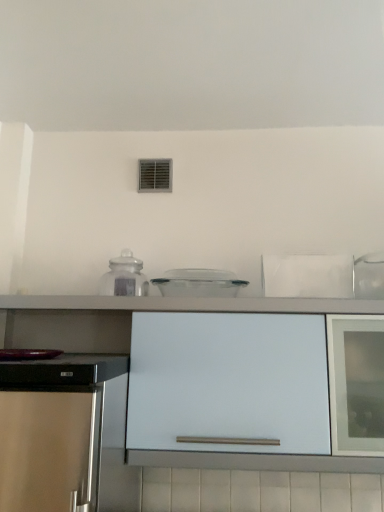
At what (x,y) coordinates should I click in order to perform the action: click on white matte cabinet at center. Please return your answer as a coordinate pair (x, y). Looking at the image, I should click on (201, 387).

In order to click on transparent glass jar at center, the first kitchen appliance positioned from the left in this screenshot , I will do `click(124, 277)`.

The height and width of the screenshot is (512, 384). I want to click on white matte cabinet at center, so click(201, 387).

Which is less distant, (164, 430) or (220, 280)?

Point (164, 430) is positioned closer to the camera compared to point (220, 280).

Identify the location of cabinetry that appears below the transparent plastic container at center, which is counted as the first kitchen appliance, starting from the right (from a real-world perspective). This screenshot has width=384, height=512. (201, 387).

Is white matte cabinet at center to the left of transparent plastic container at center, which is counted as the first kitchen appliance, starting from the right, from the viewer's perspective?

Yes.

Is transparent plastic container at center, which is counted as the first kitchen appliance, starting from the right, turned away from white matte cabinet at center?

No, transparent plastic container at center, which is counted as the first kitchen appliance, starting from the right, is not facing away from white matte cabinet at center.

Does point (167, 281) lie in front of point (115, 360)?

That is False.

Which object is further away from the camera taking this photo, transparent plastic container at center, which is counted as the first kitchen appliance, starting from the right, or white matte cabinet at center?

transparent plastic container at center, which is counted as the first kitchen appliance, starting from the right, is further from the camera.

Who is shorter, transparent plastic container at center, the 2th kitchen appliance viewed from the left, or white matte cabinet at center?

transparent plastic container at center, the 2th kitchen appliance viewed from the left.

Is the position of transparent glass jar at center, the first kitchen appliance positioned from the left, more distant than that of white matte cabinet at center?

Yes, transparent glass jar at center, the first kitchen appliance positioned from the left, is further from the camera.

Locate an element on the screen. Image resolution: width=384 pixels, height=512 pixels. kitchen appliance located on the left of white matte cabinet at center is located at coordinates (124, 277).

From the picture: Is transparent glass jar at center, the 2th kitchen appliance when ordered from right to left, far away from white matte cabinet at center?

transparent glass jar at center, the 2th kitchen appliance when ordered from right to left, is actually quite close to white matte cabinet at center.

From the image's perspective, which is above, transparent glass jar at center, the 2th kitchen appliance when ordered from right to left, or white matte cabinet at center?

transparent glass jar at center, the 2th kitchen appliance when ordered from right to left, is shown above in the image.

Considering the relative sizes of transparent glass jar at center, the first kitchen appliance positioned from the left, and transparent plastic container at center, the 2th kitchen appliance viewed from the left, in the image provided, is transparent glass jar at center, the first kitchen appliance positioned from the left, thinner than transparent plastic container at center, the 2th kitchen appliance viewed from the left,?

Yes.

Is transparent glass jar at center, the 2th kitchen appliance when ordered from right to left, facing towards transparent plastic container at center, the 2th kitchen appliance viewed from the left?

No, transparent glass jar at center, the 2th kitchen appliance when ordered from right to left, is not oriented towards transparent plastic container at center, the 2th kitchen appliance viewed from the left.

Is there a large distance between transparent glass jar at center, the 2th kitchen appliance when ordered from right to left, and transparent plastic container at center, which is counted as the first kitchen appliance, starting from the right?

No, transparent glass jar at center, the 2th kitchen appliance when ordered from right to left, is not far away from transparent plastic container at center, which is counted as the first kitchen appliance, starting from the right.

Which of these two, transparent glass jar at center, the 2th kitchen appliance when ordered from right to left, or transparent plastic container at center, the 2th kitchen appliance viewed from the left, is bigger?

Bigger between the two is transparent plastic container at center, the 2th kitchen appliance viewed from the left.

Is white matte cabinet at center inside or outside of transparent glass jar at center, the first kitchen appliance positioned from the left?

white matte cabinet at center is not inside transparent glass jar at center, the first kitchen appliance positioned from the left, it's outside.

Consider the image. From the image's perspective, is white matte cabinet at center located beneath transparent glass jar at center, the 2th kitchen appliance when ordered from right to left?

Correct, white matte cabinet at center appears lower than transparent glass jar at center, the 2th kitchen appliance when ordered from right to left, in the image.

Considering the sizes of objects white matte cabinet at center and transparent glass jar at center, the first kitchen appliance positioned from the left, in the image provided, who is thinner, white matte cabinet at center or transparent glass jar at center, the first kitchen appliance positioned from the left,?

With smaller width is transparent glass jar at center, the first kitchen appliance positioned from the left.

Does white matte cabinet at center appear on the right side of transparent glass jar at center, the 2th kitchen appliance when ordered from right to left?

Correct, you'll find white matte cabinet at center to the right of transparent glass jar at center, the 2th kitchen appliance when ordered from right to left.

Does transparent plastic container at center, which is counted as the first kitchen appliance, starting from the right, lie in front of transparent glass jar at center, the 2th kitchen appliance when ordered from right to left?

Yes, transparent plastic container at center, which is counted as the first kitchen appliance, starting from the right, is closer to the viewer.

How much distance is there between transparent plastic container at center, the 2th kitchen appliance viewed from the left, and transparent glass jar at center, the 2th kitchen appliance when ordered from right to left?

The distance of transparent plastic container at center, the 2th kitchen appliance viewed from the left, from transparent glass jar at center, the 2th kitchen appliance when ordered from right to left, is 6.74 inches.

This screenshot has height=512, width=384. Find the location of `kitchen appliance that is behind the transparent plastic container at center, which is counted as the first kitchen appliance, starting from the right`. kitchen appliance that is behind the transparent plastic container at center, which is counted as the first kitchen appliance, starting from the right is located at coordinates (124, 277).

Which of these two, transparent plastic container at center, which is counted as the first kitchen appliance, starting from the right, or transparent glass jar at center, the 2th kitchen appliance when ordered from right to left, is wider?

With larger width is transparent plastic container at center, which is counted as the first kitchen appliance, starting from the right.

In the image, there is a transparent plastic container at center, which is counted as the first kitchen appliance, starting from the right. Identify the location of cabinetry below it (from a real-world perspective). (201, 387).

The height and width of the screenshot is (512, 384). Find the location of `cabinetry on the left of the transparent plastic container at center, the 2th kitchen appliance viewed from the left`. cabinetry on the left of the transparent plastic container at center, the 2th kitchen appliance viewed from the left is located at coordinates 201,387.

Estimate the real-world distances between objects in this image. Which object is closer to transparent glass jar at center, the 2th kitchen appliance when ordered from right to left, transparent plastic container at center, the 2th kitchen appliance viewed from the left, or white matte cabinet at center?

transparent plastic container at center, the 2th kitchen appliance viewed from the left.

When comparing their distances from white matte cabinet at center, does transparent plastic container at center, which is counted as the first kitchen appliance, starting from the right, or transparent glass jar at center, the first kitchen appliance positioned from the left, seem further?

transparent glass jar at center, the first kitchen appliance positioned from the left.

Looking at the image, which one is located further to transparent glass jar at center, the first kitchen appliance positioned from the left, white matte cabinet at center or transparent plastic container at center, the 2th kitchen appliance viewed from the left?

white matte cabinet at center lies further to transparent glass jar at center, the first kitchen appliance positioned from the left, than the other object.

Considering their positions, is transparent glass jar at center, the 2th kitchen appliance when ordered from right to left, positioned closer to transparent plastic container at center, the 2th kitchen appliance viewed from the left, than white matte cabinet at center?

transparent glass jar at center, the 2th kitchen appliance when ordered from right to left.

Looking at the image, which one is located further to transparent plastic container at center, which is counted as the first kitchen appliance, starting from the right, white matte cabinet at center or transparent glass jar at center, the first kitchen appliance positioned from the left?

Based on the image, white matte cabinet at center appears to be further to transparent plastic container at center, which is counted as the first kitchen appliance, starting from the right.

Which object lies further to the anchor point white matte cabinet at center, transparent glass jar at center, the first kitchen appliance positioned from the left, or transparent plastic container at center, which is counted as the first kitchen appliance, starting from the right?

transparent glass jar at center, the first kitchen appliance positioned from the left, lies further to white matte cabinet at center than the other object.

Identify the location of kitchen appliance that lies between transparent glass jar at center, the first kitchen appliance positioned from the left, and white matte cabinet at center from top to bottom. This screenshot has width=384, height=512. (199, 283).